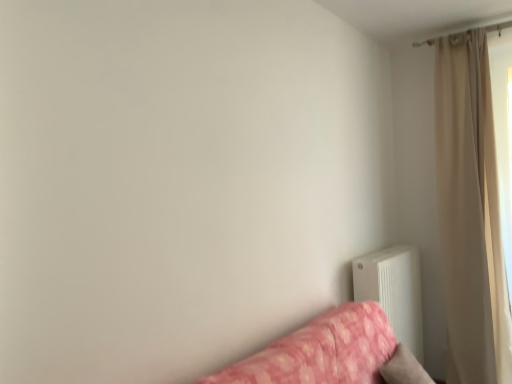
Question: Can you confirm if white matte radiator at lower right is taller than beige fabric curtain at upper right?

Choices:
 (A) no
 (B) yes

Answer: (A)

Question: Would you say beige fabric curtain at upper right is part of white matte radiator at lower right's contents?

Choices:
 (A) no
 (B) yes

Answer: (A)

Question: Is beige fabric curtain at upper right at the back of white matte radiator at lower right?

Choices:
 (A) no
 (B) yes

Answer: (A)

Question: Could you tell me if white matte radiator at lower right is facing beige fabric curtain at upper right?

Choices:
 (A) no
 (B) yes

Answer: (A)

Question: Is the position of white matte radiator at lower right less distant than that of beige fabric curtain at upper right?

Choices:
 (A) no
 (B) yes

Answer: (B)

Question: Looking at the image, does white matte radiator at lower right seem bigger or smaller compared to beige fabric curtain at upper right?

Choices:
 (A) small
 (B) big

Answer: (A)

Question: Looking at their shapes, would you say white matte radiator at lower right is wider or thinner than beige fabric curtain at upper right?

Choices:
 (A) wide
 (B) thin

Answer: (B)

Question: Is white matte radiator at lower right taller or shorter than beige fabric curtain at upper right?

Choices:
 (A) tall
 (B) short

Answer: (B)

Question: Is white matte radiator at lower right in front of or behind beige fabric curtain at upper right in the image?

Choices:
 (A) front
 (B) behind

Answer: (A)

Question: From the image's perspective, is white matte radiator at lower right located above or below pink floral fabric studio couch at lower right?

Choices:
 (A) above
 (B) below

Answer: (A)

Question: Looking at their shapes, would you say white matte radiator at lower right is wider or thinner than pink floral fabric studio couch at lower right?

Choices:
 (A) wide
 (B) thin

Answer: (B)

Question: Would you say white matte radiator at lower right is inside or outside pink floral fabric studio couch at lower right?

Choices:
 (A) inside
 (B) outside

Answer: (B)

Question: In the image, is white matte radiator at lower right positioned in front of or behind pink floral fabric studio couch at lower right?

Choices:
 (A) behind
 (B) front

Answer: (A)

Question: From the image's perspective, is pink floral fabric studio couch at lower right located above or below beige fabric curtain at upper right?

Choices:
 (A) below
 (B) above

Answer: (A)

Question: Considering the positions of point (339, 304) and point (484, 329), is point (339, 304) closer or farther from the camera than point (484, 329)?

Choices:
 (A) closer
 (B) farther

Answer: (A)